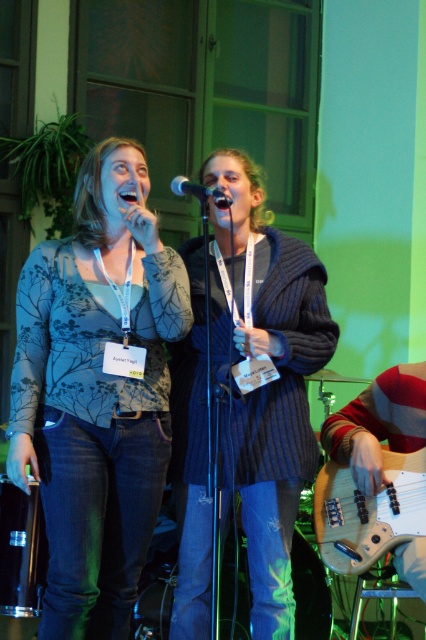
You are sitting in the front row of the audience and see two points on the stage. The first point is at coordinate point (396, 454) and the second point is at coordinate point (204, 200). Which point is closer to you?

Point (204, 200) is closer to you because it is nearer to the camera than point (396, 454).

Based on the photo, you are an event planner assessing the stage setup. You need to ensure that the matte floral top at center and the metallic silver microphone at center are positioned so that the wider object is placed on the left side for better visual balance. Based on the description, which object should be placed on the left?

The matte floral top at center is wider than the metallic silver microphone at center, so it should be placed on the left side for better visual balance.